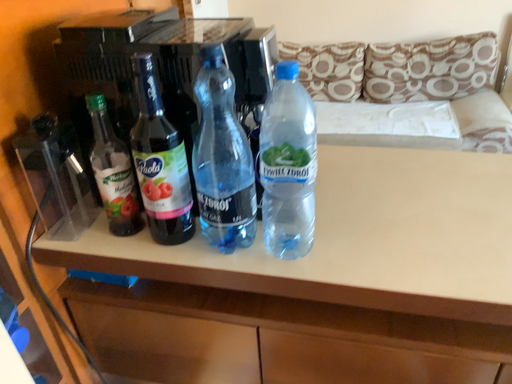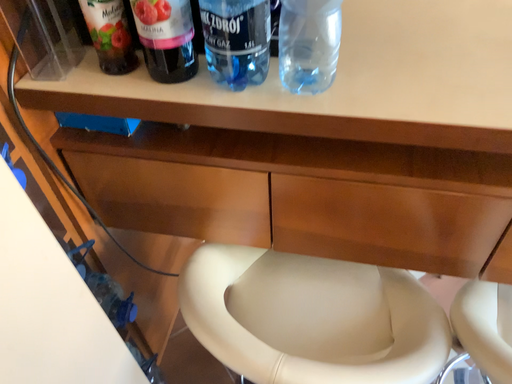
Question: Which way did the camera rotate in the video?

Choices:
 (A) rotated upward
 (B) rotated downward

Answer: (B)